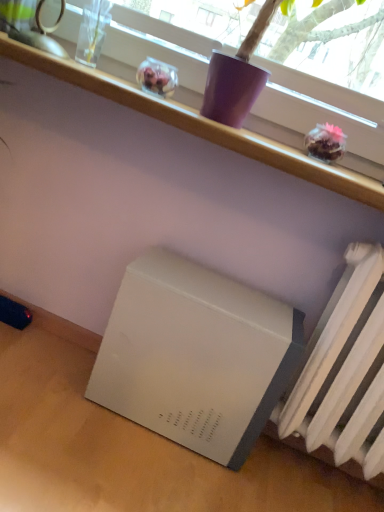
Find the location of a particular element. The width and height of the screenshot is (384, 512). blank area to the left of white matte refrigerator at lower left is located at coordinates [51, 395].